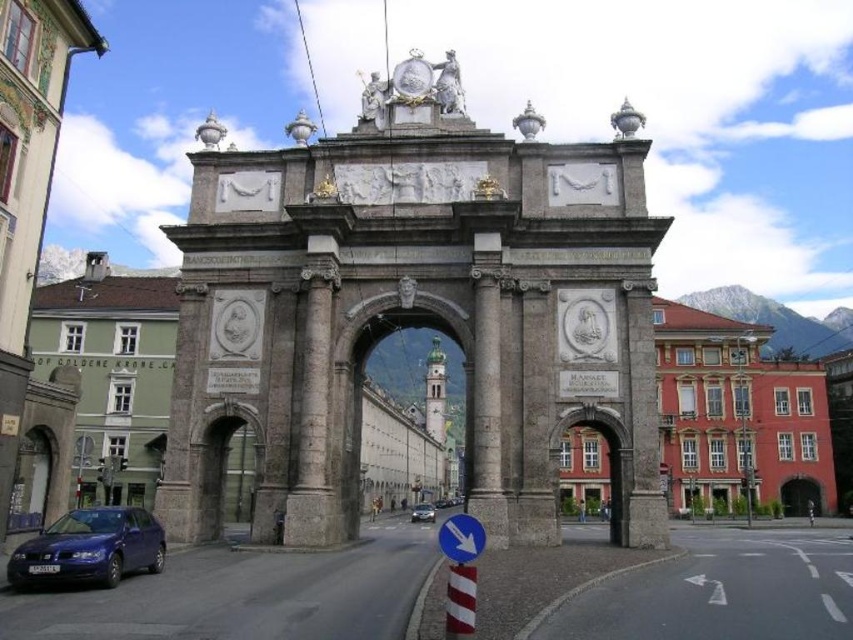
Who is positioned more to the right, stone archway at center or metallic blue sedan at lower left?

Positioned to the right is stone archway at center.

Between stone archway at center and metallic blue sedan at lower left, which one has more height?

stone archway at center

Describe the element at coordinates (409, 440) in the screenshot. The image size is (853, 640). I see `stone archway at center` at that location.

Find the location of a particular element. The image size is (853, 640). stone archway at center is located at coordinates (409, 440).

How distant is stone archway at center from metallic silver car at center?

A distance of 55.61 feet exists between stone archway at center and metallic silver car at center.

Which is more to the left, stone archway at center or metallic silver car at center?

Positioned to the left is stone archway at center.

Between point (378, 412) and point (418, 518), which one is positioned behind?

The point (378, 412) is behind.

Find the location of `stone archway at center`. stone archway at center is located at coordinates (409, 440).

Which is more to the right, metallic blue sedan at lower left or metallic silver car at center?

Positioned to the right is metallic silver car at center.

Who is shorter, metallic blue sedan at lower left or metallic silver car at center?

Standing shorter between the two is metallic blue sedan at lower left.

Which is in front, point (62, 560) or point (415, 520)?

Positioned in front is point (62, 560).

In order to click on metallic blue sedan at lower left in this screenshot , I will do `click(90, 548)`.